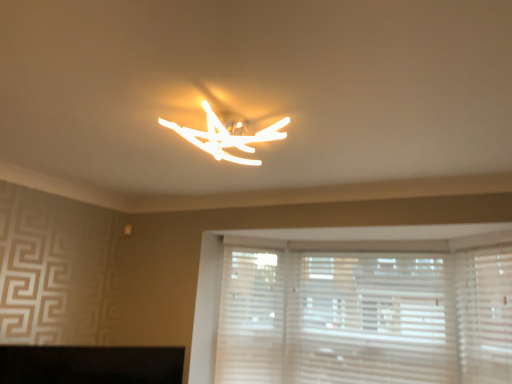
Question: Considering the relative positions of matte white light fixture at center and white textured blinds at lower right in the image provided, is matte white light fixture at center in front of white textured blinds at lower right?

Choices:
 (A) no
 (B) yes

Answer: (B)

Question: From a real-world perspective, is matte white light fixture at center over white textured blinds at lower right?

Choices:
 (A) yes
 (B) no

Answer: (A)

Question: Is matte white light fixture at center shorter than white textured blinds at lower right?

Choices:
 (A) yes
 (B) no

Answer: (A)

Question: Is matte white light fixture at center positioned behind white textured blinds at lower right?

Choices:
 (A) no
 (B) yes

Answer: (A)

Question: Does matte white light fixture at center turn towards white textured blinds at lower right?

Choices:
 (A) yes
 (B) no

Answer: (B)

Question: Would you say matte white light fixture at center is a long distance from white textured blinds at lower right?

Choices:
 (A) no
 (B) yes

Answer: (B)

Question: Is matte white light fixture at center at the right side of white matte shutter at lower center, positioned as the second shutter in front-to-back order?

Choices:
 (A) yes
 (B) no

Answer: (B)

Question: From the image's perspective, is matte white light fixture at center on white matte shutter at lower center, arranged as the 2th shutter when viewed from the right?

Choices:
 (A) no
 (B) yes

Answer: (B)

Question: Does matte white light fixture at center have a greater height compared to white matte shutter at lower center, positioned as the second shutter in front-to-back order?

Choices:
 (A) yes
 (B) no

Answer: (B)

Question: Considering the relative positions of matte white light fixture at center and white matte shutter at lower center, arranged as the first shutter when viewed from the left, in the image provided, is matte white light fixture at center to the left of white matte shutter at lower center, arranged as the first shutter when viewed from the left, from the viewer's perspective?

Choices:
 (A) no
 (B) yes

Answer: (B)

Question: Is white matte shutter at lower center, arranged as the 2th shutter when viewed from the right, at the back of matte white light fixture at center?

Choices:
 (A) yes
 (B) no

Answer: (B)

Question: Is matte white light fixture at center oriented towards white matte shutter at lower center, arranged as the first shutter when viewed from the left?

Choices:
 (A) yes
 (B) no

Answer: (B)

Question: Can you confirm if white textured blinds at lower right is wider than white matte shutter at right, the 2th shutter from the left?

Choices:
 (A) no
 (B) yes

Answer: (B)